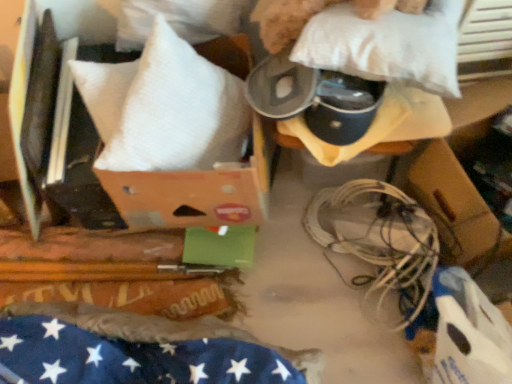
Question: Is point (435, 16) closer or farther from the camera than point (137, 109)?

Choices:
 (A) closer
 (B) farther

Answer: (B)

Question: Looking at their shapes, would you say white soft pillow at upper center, which is the 2th pillow from left to right, is wider or thinner than white soft pillow at upper left, the first pillow positioned from the left?

Choices:
 (A) wide
 (B) thin

Answer: (B)

Question: Which of these objects is positioned farthest from the white soft pillow at upper center, arranged as the first pillow when viewed from the right?

Choices:
 (A) white soft pillow at upper left, the 2th pillow in the right-to-left sequence
 (B) white matte wires at lower right

Answer: (B)

Question: Which of these objects is positioned closest to the white soft pillow at upper left, the 2th pillow in the right-to-left sequence?

Choices:
 (A) white matte wires at lower right
 (B) white soft pillow at upper center, which is the 2th pillow from left to right

Answer: (B)